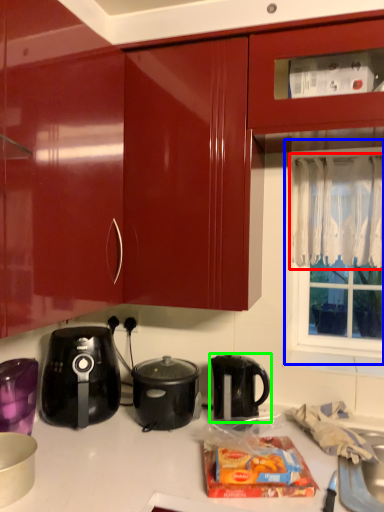
Question: Estimate the real-world distances between objects in this image. Which object is farther from curtain (highlighted by a red box), window screen (highlighted by a blue box) or kettle (highlighted by a green box)?

Choices:
 (A) window screen
 (B) kettle

Answer: (B)